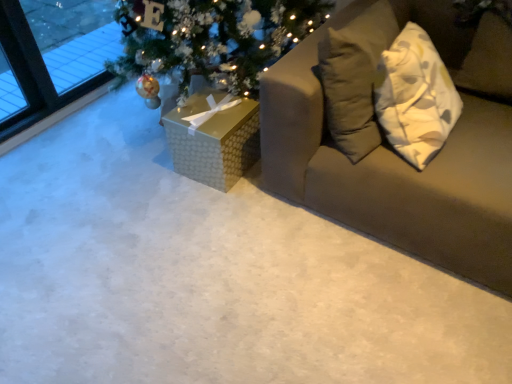
This screenshot has width=512, height=384. I want to click on free space above gold textured gift box at center (from a real-world perspective), so click(x=222, y=107).